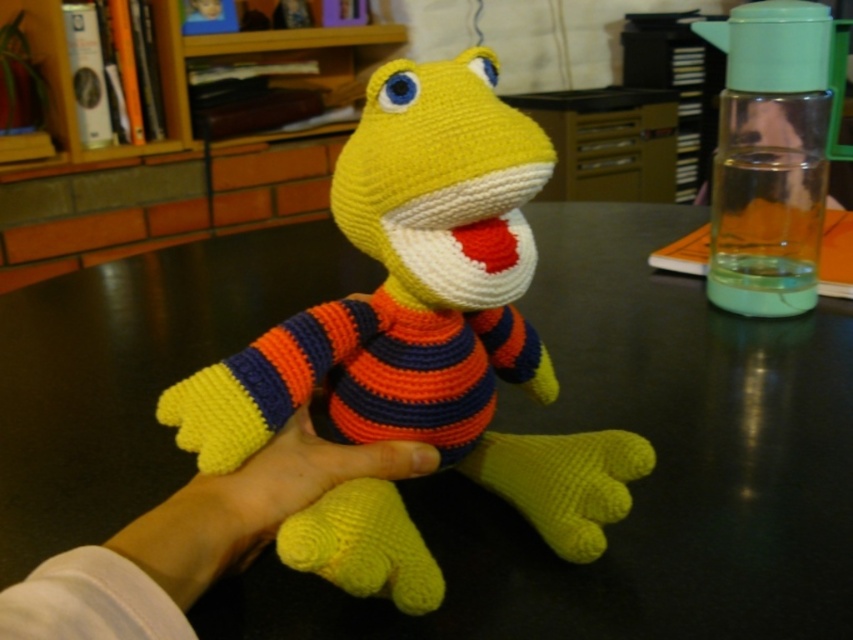
Looking at this image, you are trying to place a small vase on the black glossy table at center. However, there is yellow yarn at lower center in the way. Can you place the vase on the table without moving the yarn?

The black glossy table at center is above the yellow yarn at lower center, so yes, you can place the vase on the table without moving the yarn since the table is elevated and the yarn is below it.

You are a toy maker who wants to place the black glossy table at center on the yellow yarn hand at center. Can you fit the table on the hand without overlapping?

The distance between the black glossy table at center and yellow yarn hand at center is 11.03 inches, so the table can be placed on the hand without overlapping since the distance is sufficient.

You are an observer looking at the image of a crocheted toy dinosaur. You notice the yellow yarn toy at center and the yellow yarn hand at center. Which object is closer to you?

The yellow yarn toy at center is closer to you than the yellow yarn hand at center.